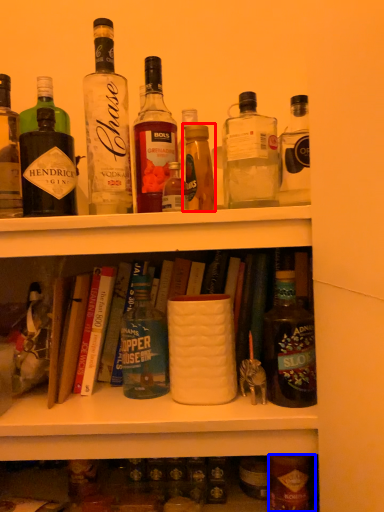
Question: Which object is closer to the camera taking this photo, bottle (highlighted by a red box) or bottle (highlighted by a blue box)?

Choices:
 (A) bottle
 (B) bottle

Answer: (A)